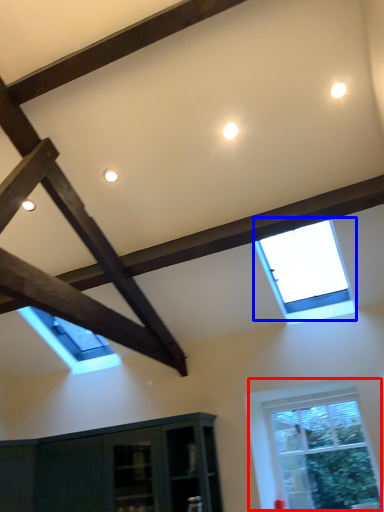
Question: Which of the following is the farthest to the observer, window (highlighted by a red box) or window (highlighted by a blue box)?

Choices:
 (A) window
 (B) window

Answer: (A)